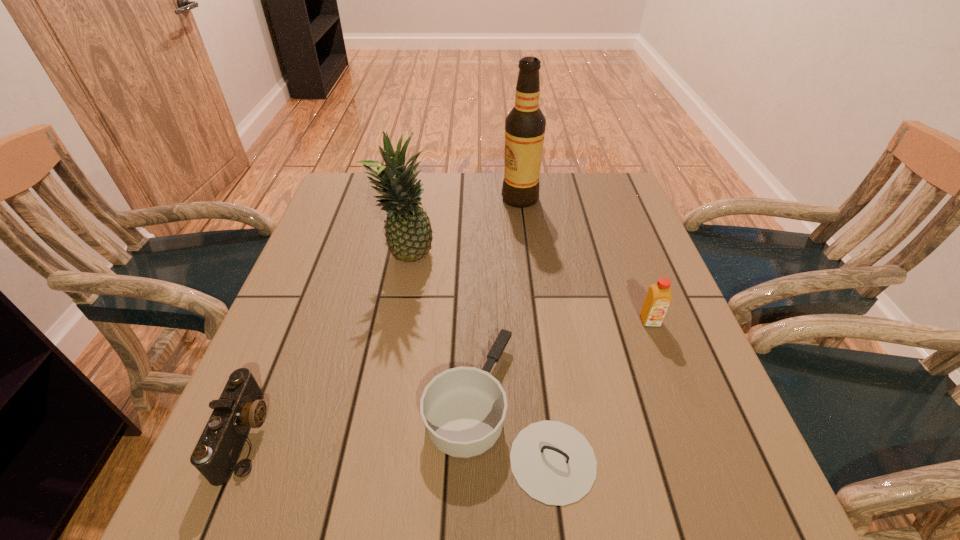
The height and width of the screenshot is (540, 960). Find the location of `blank region between the tallest object and the second shortest object`. blank region between the tallest object and the second shortest object is located at coordinates (383, 316).

Where is `free spot between the leftmost object and the second farthest object`? free spot between the leftmost object and the second farthest object is located at coordinates (326, 346).

The width and height of the screenshot is (960, 540). I want to click on vacant region between the shortest object and the orange juice, so click(578, 366).

Locate an element on the screen. This screenshot has height=540, width=960. vacant space that is in between the pineapple and the saucepan is located at coordinates (456, 334).

At what (x,y) coordinates should I click in order to perform the action: click on free space that is in between the alcohol and the third shortest object. Please return your answer as a coordinate pair (x, y). This screenshot has width=960, height=540. Looking at the image, I should click on (585, 260).

The width and height of the screenshot is (960, 540). I want to click on vacant area that lies between the pineapple and the rightmost object, so click(x=528, y=289).

Where is `vacant space that's between the third nearest object and the farthest object`? The image size is (960, 540). vacant space that's between the third nearest object and the farthest object is located at coordinates (585, 260).

The height and width of the screenshot is (540, 960). What are the coordinates of `free space between the farthest object and the second shortest object` in the screenshot? It's located at (383, 316).

Identify which object is located as the third nearest to the third shortest object. Please provide its 2D coordinates. Your answer should be formatted as a tuple, i.e. [(x, y)], where the tuple contains the x and y coordinates of a point satisfying the conditions above.

[(408, 232)]

Choose which object is the nearest neighbor to the leftmost object. Please provide its 2D coordinates. Your answer should be formatted as a tuple, i.e. [(x, y)], where the tuple contains the x and y coordinates of a point satisfying the conditions above.

[(463, 408)]